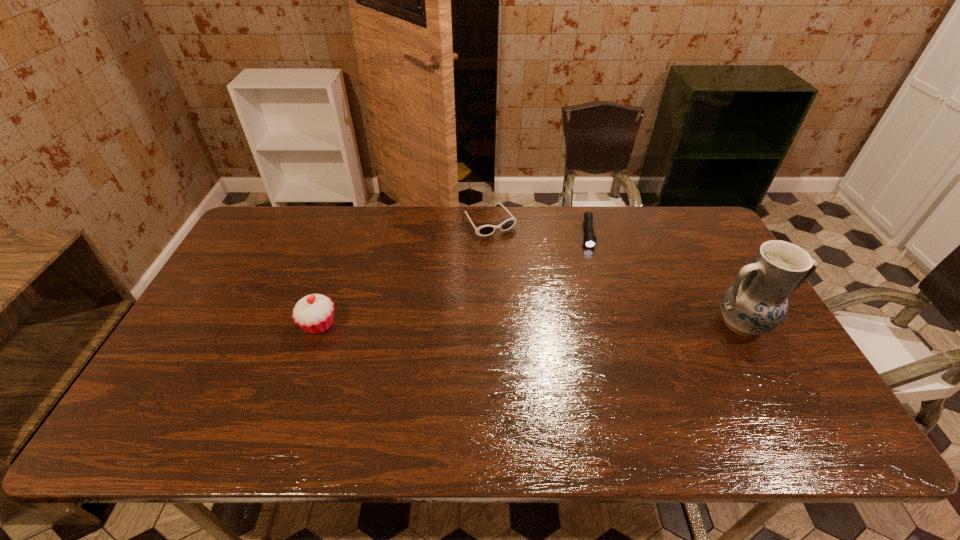
The image size is (960, 540). I want to click on free location located with the lenses of the sunglasses facing outward, so click(x=552, y=306).

Identify the location of free region located 0.240m with the lenses of the sunglasses facing outward. (535, 283).

Where is `vacant space located 0.260m with the lenses of the sunglasses facing outward`? vacant space located 0.260m with the lenses of the sunglasses facing outward is located at coordinates (539, 287).

The height and width of the screenshot is (540, 960). What are the coordinates of `free space located at the lens end of the third object from left to right` in the screenshot? It's located at pyautogui.click(x=595, y=314).

In order to click on free space located at the lens end of the third object from left to right in this screenshot , I will do `click(594, 289)`.

This screenshot has height=540, width=960. I want to click on vacant space located at the lens end of the third object from left to right, so click(592, 266).

The image size is (960, 540). Find the location of `sunglasses present at the far edge`. sunglasses present at the far edge is located at coordinates (485, 230).

This screenshot has height=540, width=960. I want to click on flashlight at the far edge, so [589, 239].

Locate an element on the screen. object positioned at the right edge is located at coordinates (756, 303).

The height and width of the screenshot is (540, 960). What are the coordinates of `vacant area at the far edge` in the screenshot? It's located at (668, 242).